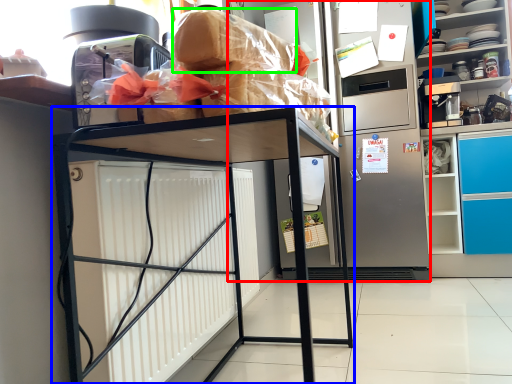
Question: Which is nearer to the appliance (highlighted by a red box)? furniture (highlighted by a blue box) or bread (highlighted by a green box).

Choices:
 (A) furniture
 (B) bread

Answer: (A)